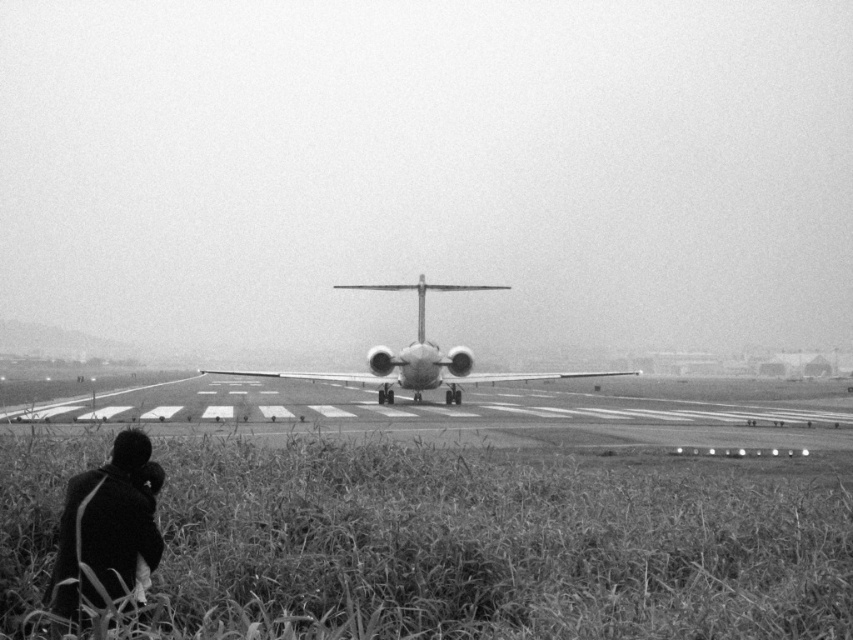
You are standing at the airport and see the dark fabric coat at lower left and the metallic airplane at center. Which object is taller?

The metallic airplane at center is taller than the dark fabric coat at lower left.

Looking at this image, you are standing at the center of the runway and see the dark fabric coat at lower left. Based on its coordinates, in which direction should you walk to reach it?

The dark fabric coat at lower left is located at coordinates point (107,525). Since the lower left corner is the origin point, you should walk southwest to reach it.

You are standing at the point labeled point (149, 522) and want to walk to the airplane on the runway. Is the point labeled point (236, 374) between you and the airplane?

Yes, the point labeled point (236, 374) is between you and the airplane because point (149, 522) is in front of point (236, 374), meaning the airplane is further away from you.